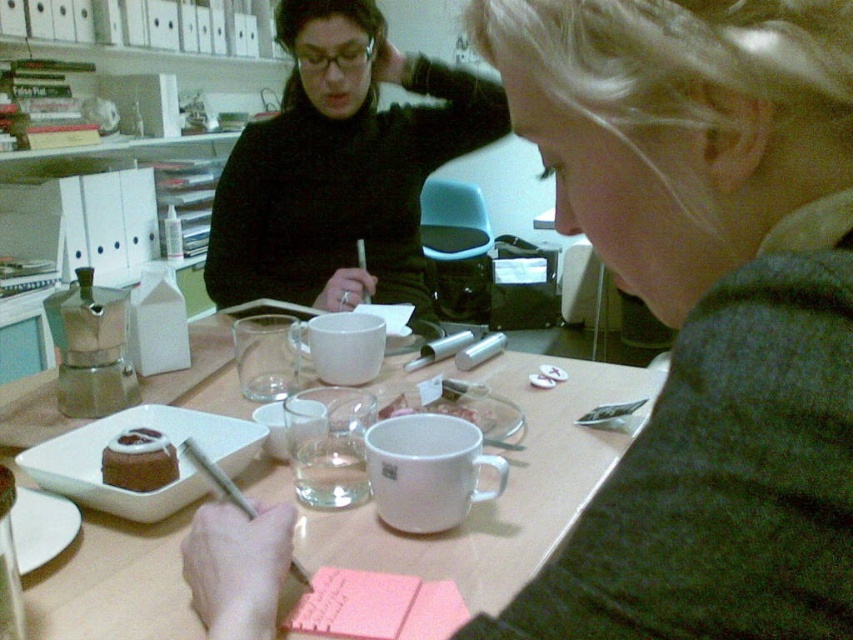
Question: Which point appears closest to the camera in this image?

Choices:
 (A) (461, 148)
 (B) (334, 524)
 (C) (114, 483)

Answer: (B)

Question: Which of the following is the farthest from the observer?

Choices:
 (A) (148, 490)
 (B) (395, 225)

Answer: (B)

Question: Based on their relative distances, which object is farther from the white matte table at center?

Choices:
 (A) chocolate frosted cake at center
 (B) black matte sweater at upper center

Answer: (B)

Question: Does black matte sweater at upper center appear under white matte table at center?

Choices:
 (A) yes
 (B) no

Answer: (B)

Question: Is white matte table at center smaller than chocolate frosted cake at center?

Choices:
 (A) yes
 (B) no

Answer: (B)

Question: Considering the relative positions of white matte table at center and chocolate frosted cake at center in the image provided, where is white matte table at center located with respect to chocolate frosted cake at center?

Choices:
 (A) right
 (B) left

Answer: (A)